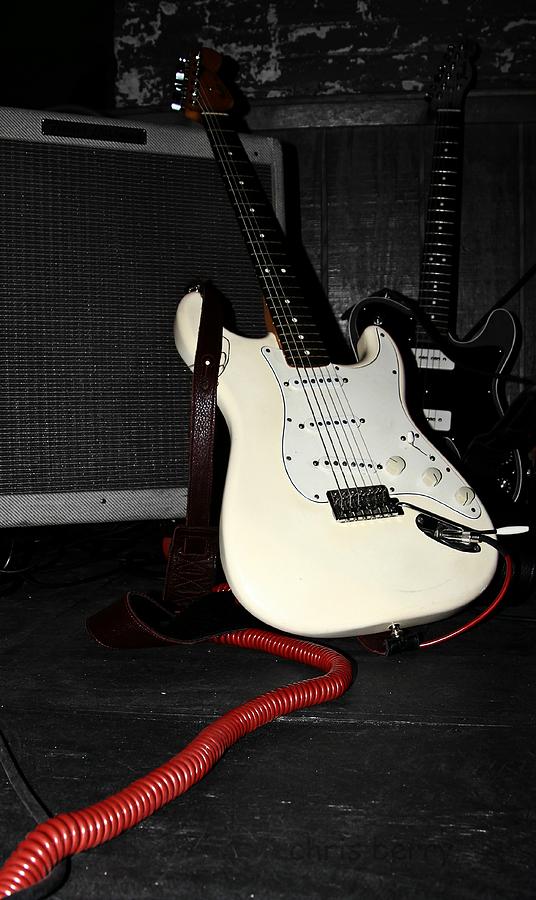
I want to click on white handled switch, so click(x=509, y=527).